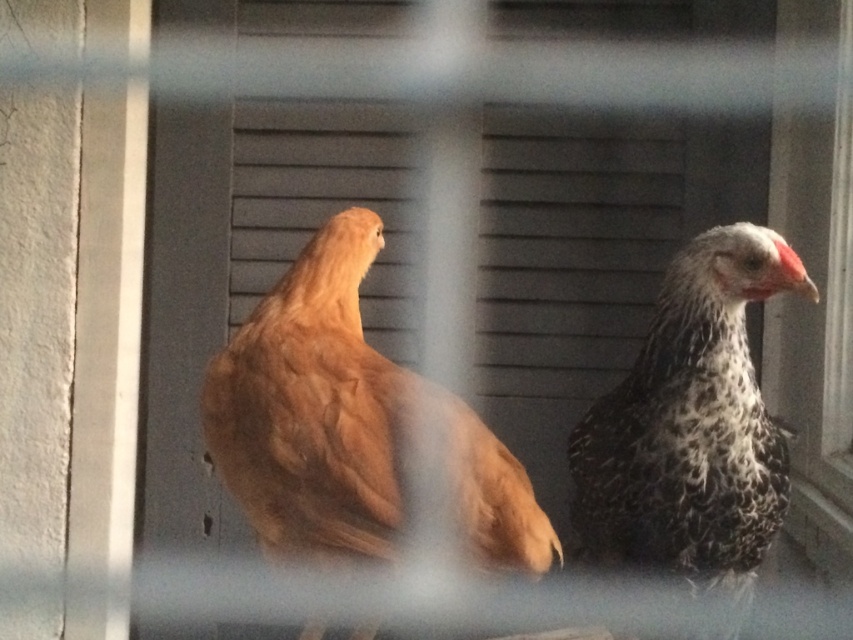
Who is more forward, (335,387) or (784,458)?

Positioned in front is point (335,387).

Which of these two, golden feathered chicken at center or speckled feathered chicken at right, stands shorter?

speckled feathered chicken at right

Is point (283, 504) positioned behind point (640, 396)?

No.

At what (x,y) coordinates should I click in order to perform the action: click on golden feathered chicken at center. Please return your answer as a coordinate pair (x, y). Image resolution: width=853 pixels, height=640 pixels. Looking at the image, I should click on (350, 426).